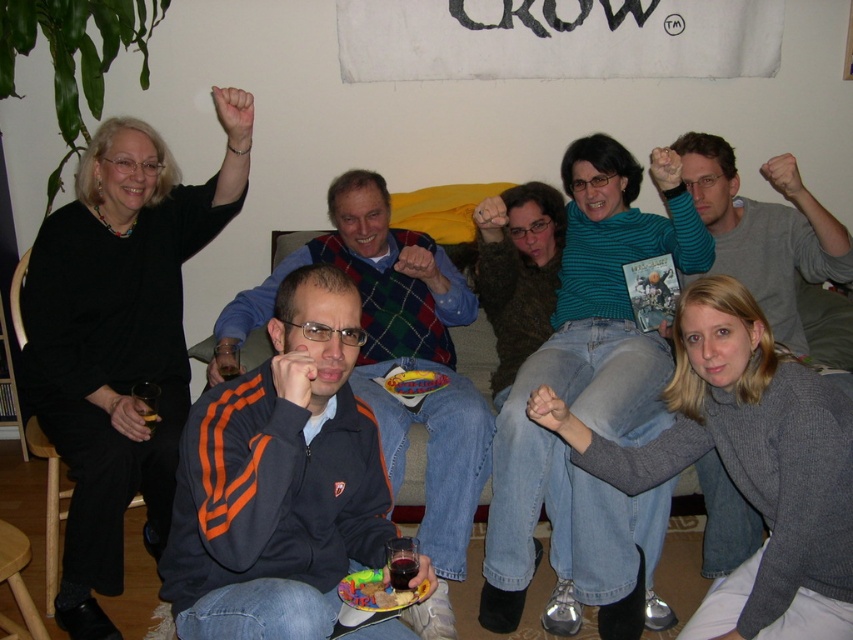
Does knitted gray sweater at lower right appear on the left side of gray sweater at center?

Indeed, knitted gray sweater at lower right is positioned on the left side of gray sweater at center.

Between knitted gray sweater at lower right and gray sweater at center, which one is positioned higher?

gray sweater at center is higher up.

Where is `knitted gray sweater at lower right`? knitted gray sweater at lower right is located at coordinates (747, 460).

Does black matte sweater at upper left have a greater height compared to knitted gray sweater at lower right?

Yes.

Identify the location of black matte sweater at upper left. (119, 339).

Is black matte sweater at upper left to the right of gray sweater at center from the viewer's perspective?

Incorrect, black matte sweater at upper left is not on the right side of gray sweater at center.

Is black matte sweater at upper left above gray sweater at center?

No, black matte sweater at upper left is not above gray sweater at center.

The width and height of the screenshot is (853, 640). What do you see at coordinates (119, 339) in the screenshot?
I see `black matte sweater at upper left` at bounding box center [119, 339].

The height and width of the screenshot is (640, 853). Find the location of `black matte sweater at upper left`. black matte sweater at upper left is located at coordinates (119, 339).